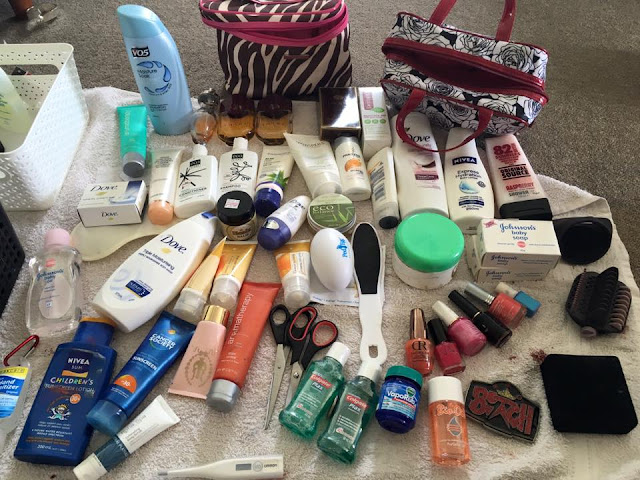
Find the location of a particular element. The image size is (640, 480). boxes is located at coordinates click(116, 202), click(527, 243), click(493, 280), click(371, 119), click(339, 119).